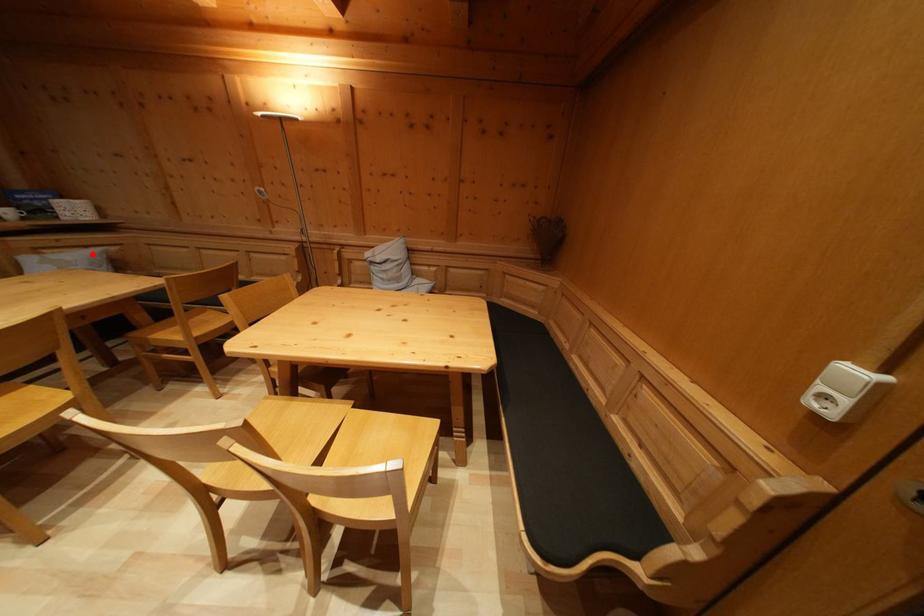
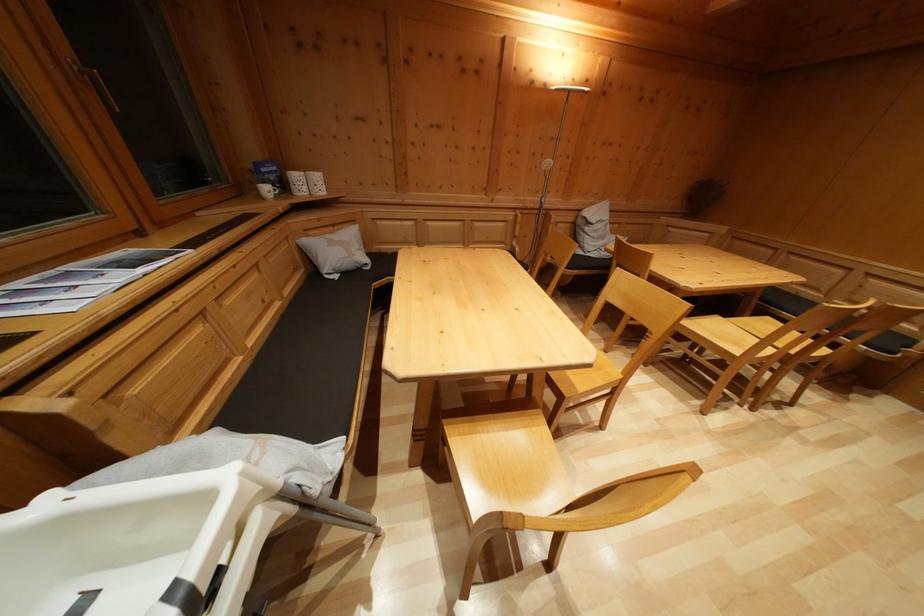
In the second image, find the point that corresponds to the highlighted location in the first image.

(338, 233)